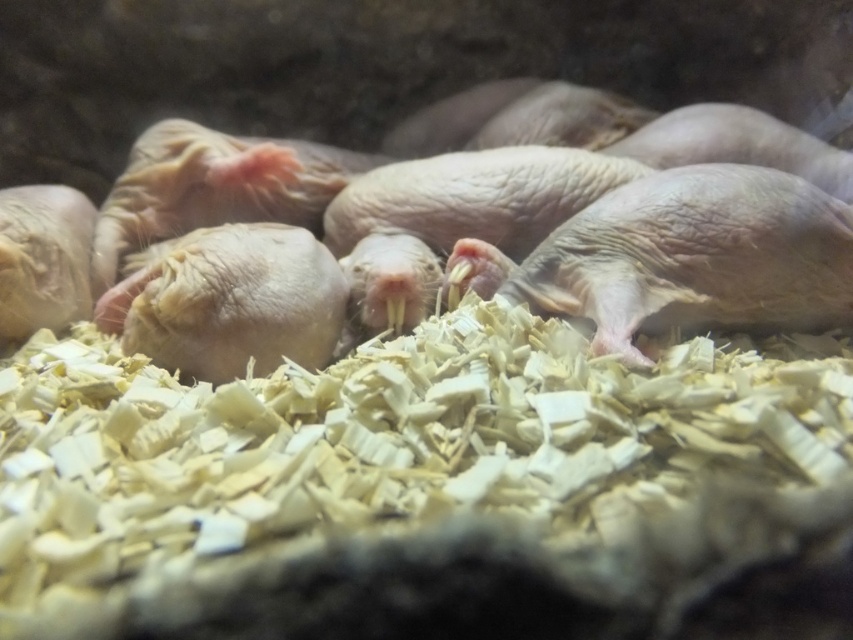
Question: Among these objects, which one is nearest to the camera?

Choices:
 (A) white shredded wood at center
 (B) pink smooth rodent at center
 (C) pink wrinkled mole at left
 (D) pinkish-brown wrinkled mole at center

Answer: (A)

Question: Does white shredded wood at center come in front of pink wrinkled mole at left?

Choices:
 (A) no
 (B) yes

Answer: (B)

Question: Is the position of pink smooth rodent at center more distant than that of pink wrinkled mole at left?

Choices:
 (A) yes
 (B) no

Answer: (B)

Question: From the image, what is the correct spatial relationship of pinkish-brown wrinkled mole at center in relation to pink smooth rodent at center?

Choices:
 (A) above
 (B) below

Answer: (A)

Question: Which of the following is the closest to the observer?

Choices:
 (A) pink wrinkled mole at left
 (B) white shredded wood at center
 (C) pink smooth rodent at center
 (D) pinkish-brown wrinkled mole at center

Answer: (B)

Question: Which of the following is the farthest from the observer?

Choices:
 (A) (51, 284)
 (B) (489, 534)

Answer: (A)